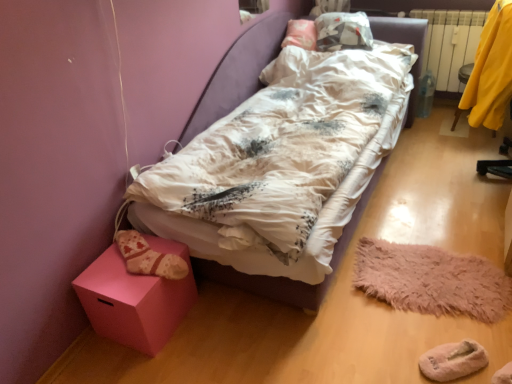
Locate an element on the screen. This screenshot has height=384, width=512. blank space situated above pink matte cube at lower left (from a real-world perspective) is located at coordinates (120, 265).